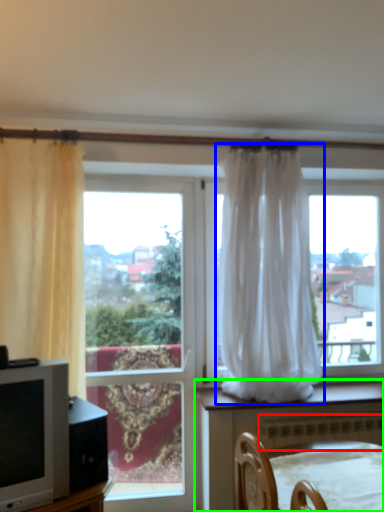
Question: Considering the real-world distances, which object is closest to radiator (highlighted by a red box)? curtain (highlighted by a blue box) or furniture (highlighted by a green box).

Choices:
 (A) curtain
 (B) furniture

Answer: (B)